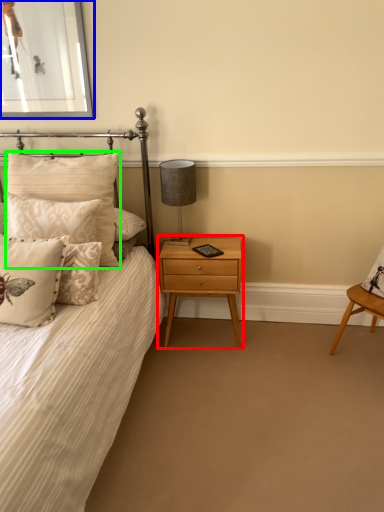
Question: Estimate the real-world distances between objects in this image. Which object is farther from nightstand (highlighted by a red box), picture frame (highlighted by a blue box) or pillow (highlighted by a green box)?

Choices:
 (A) picture frame
 (B) pillow

Answer: (A)